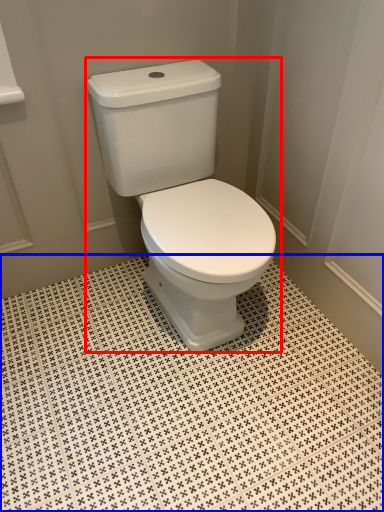
Question: Which of the following is the farthest to the observer, toilet (highlighted by a red box) or ceramic tile (highlighted by a blue box)?

Choices:
 (A) toilet
 (B) ceramic tile

Answer: (A)